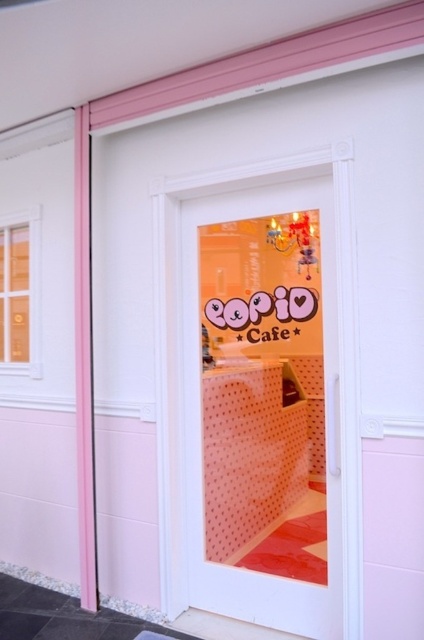
You are a delivery person trying to enter Copo Cafe. You see the transparent glass door at center. Where should you approach to enter the cafe?

The transparent glass door at center is located at point 0.553 on the x axis and 0.434 on the y axis, so you should approach the transparent glass door at center at that coordinate to enter the cafe.

You are a delivery person trying to enter Copo Cafe. The transparent glass door at center is locked, but you can see the matte glass window at upper left. Which one should you knock on to get someone to open the door?

You should knock on the transparent glass door at center because it is closer to the viewer and likely the entrance, so the staff can hear and open it.